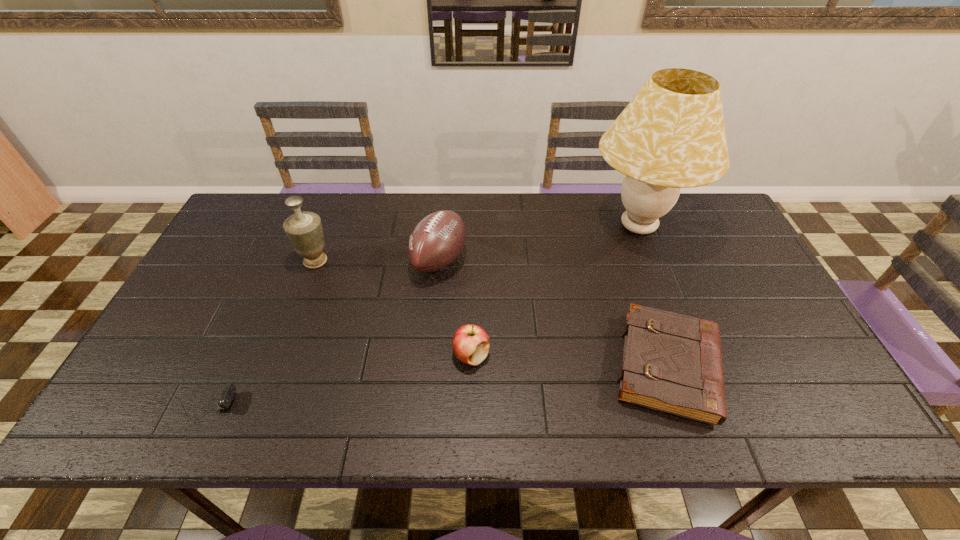
This screenshot has height=540, width=960. I want to click on free space located 0.340m on the right of the third tallest object, so click(x=582, y=260).

Find the location of a particular element. free space located on the front of the third shortest object is located at coordinates (470, 391).

At what (x,y) coordinates should I click in order to perform the action: click on free region located on the back of the hardback book. Please return your answer as a coordinate pair (x, y). Looking at the image, I should click on (621, 230).

The height and width of the screenshot is (540, 960). I want to click on free space located 0.370m on the front-facing side of the shortest object, so click(400, 405).

Identify the location of lampshade that is at the far edge. (671, 135).

The height and width of the screenshot is (540, 960). In order to click on football (American) positioned at the far edge in this screenshot , I will do `click(436, 241)`.

Locate an element on the screen. The height and width of the screenshot is (540, 960). hardback book that is at the near edge is located at coordinates (672, 363).

Where is `webcam present at the near edge`? The width and height of the screenshot is (960, 540). webcam present at the near edge is located at coordinates (229, 390).

This screenshot has width=960, height=540. Find the location of `object that is at the left edge`. object that is at the left edge is located at coordinates (229, 390).

Where is `object positioned at the right edge`? The height and width of the screenshot is (540, 960). object positioned at the right edge is located at coordinates (671, 135).